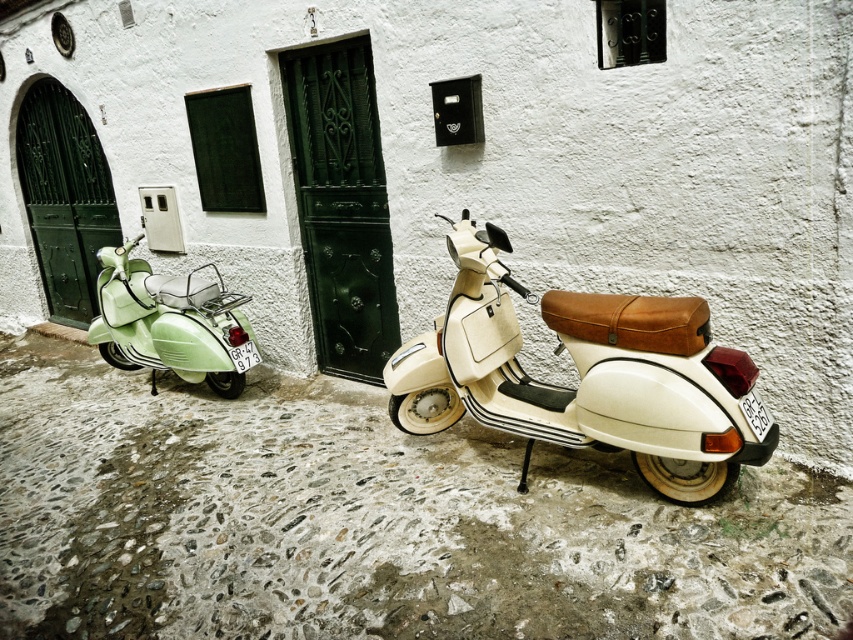
Question: Is matte cream scooter at center thinner than pastel green matte scooter at left?

Choices:
 (A) yes
 (B) no

Answer: (B)

Question: Which of the following is the farthest from the observer?

Choices:
 (A) matte cream scooter at center
 (B) pastel green matte scooter at left

Answer: (B)

Question: Is matte cream scooter at center to the left of pastel green matte scooter at left from the viewer's perspective?

Choices:
 (A) yes
 (B) no

Answer: (B)

Question: Does matte cream scooter at center come behind pastel green matte scooter at left?

Choices:
 (A) yes
 (B) no

Answer: (B)